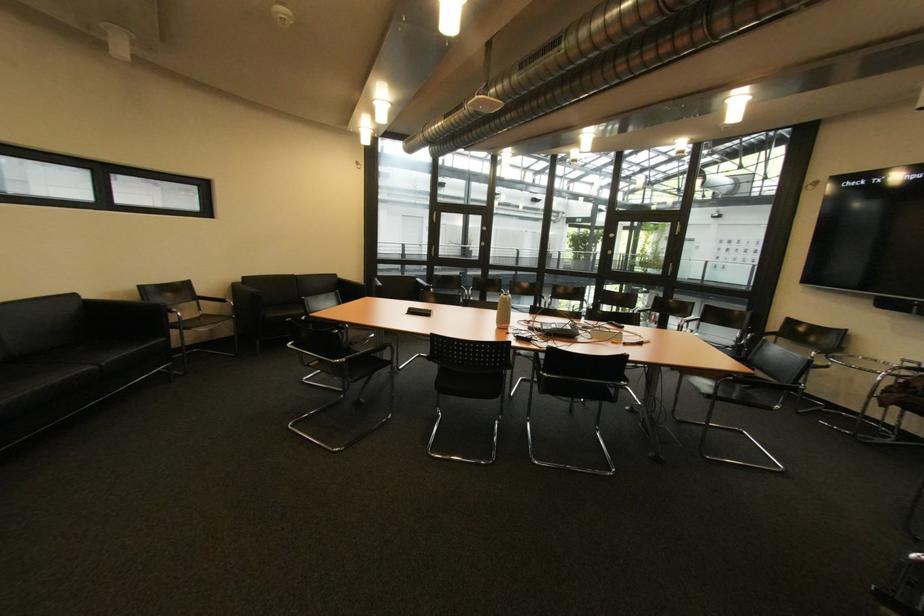
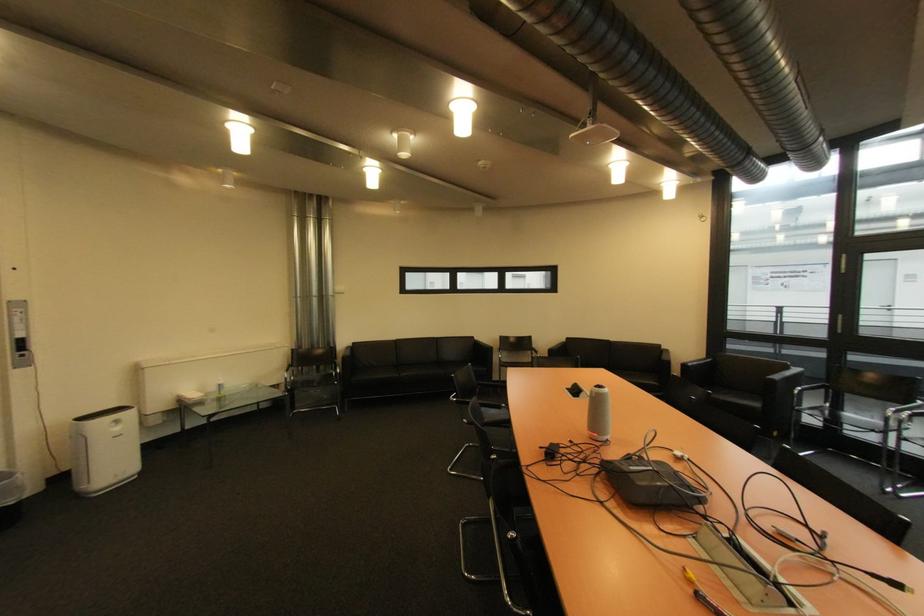
Question: I am providing you with two images of the same scene from different viewpoints. After the viewpoint changes to image2, which objects are now occluded?

Choices:
 (A) black conference phone
 (B) black trash can
 (C) black chair armrest
 (D) none of these

Answer: (D)